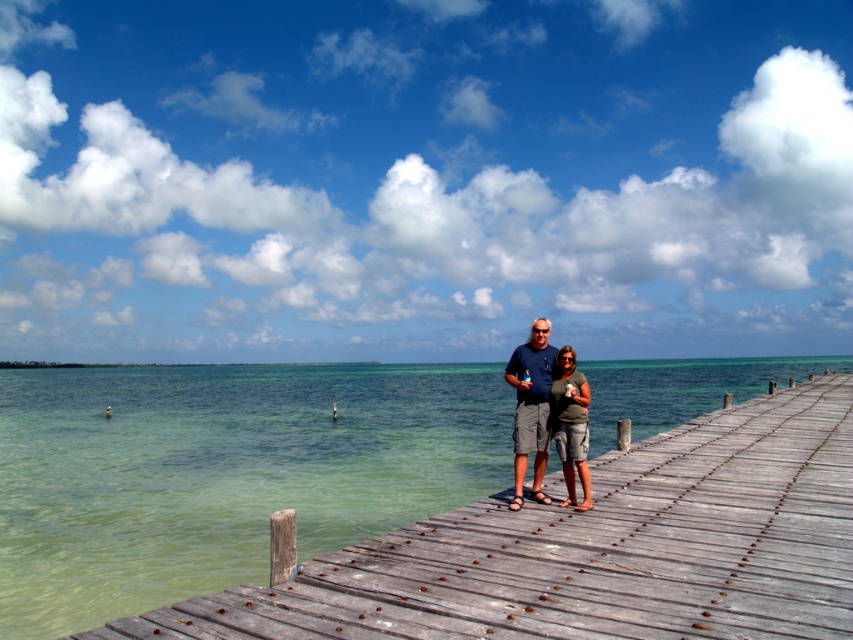
You are standing on the wooden dock at center and want to jump into the turquoise waters below. The safety rule states that you must be at least 4 meters away from the edge of the dock to jump safely. Is your current position safe for jumping?

The wooden dock at center and viewer are 4.36 meters apart, which is more than the required 4 meters, so your current position is safe for jumping.